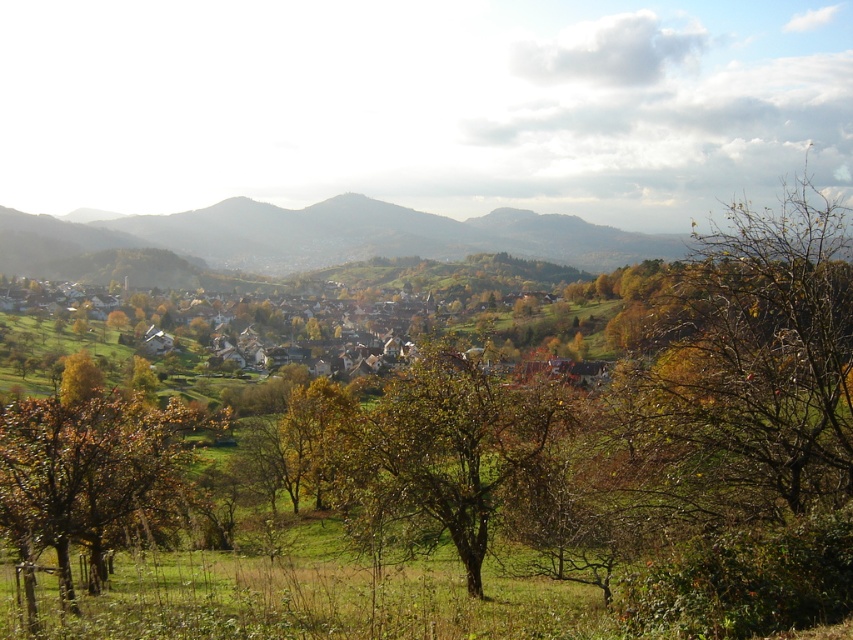
Question: Observing the image, what is the correct spatial positioning of rugged brown mountain at center in reference to brown leafy tree at lower left?

Choices:
 (A) right
 (B) left

Answer: (B)

Question: Which of the following is the closest to the observer?

Choices:
 (A) brown leafless tree at right
 (B) green leafy tree at center
 (C) rugged brown mountain at center

Answer: (A)

Question: Is brown leafless tree at right to the left of brown leafy tree at lower left from the viewer's perspective?

Choices:
 (A) no
 (B) yes

Answer: (A)

Question: Which object appears closest to the camera in this image?

Choices:
 (A) rugged brown mountain at center
 (B) green leafy tree at center

Answer: (B)

Question: Is green leafy tree at center bigger than rugged brown mountain at center?

Choices:
 (A) no
 (B) yes

Answer: (A)

Question: Which of the following is the farthest from the observer?

Choices:
 (A) (636, 259)
 (B) (436, 388)
 (C) (679, 368)
 (D) (115, 470)

Answer: (A)